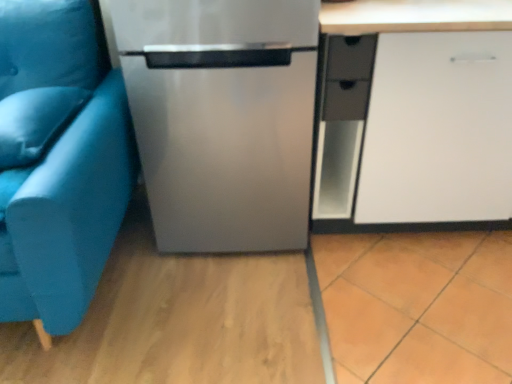
Describe the element at coordinates (414, 115) in the screenshot. I see `white matte cabinet at right` at that location.

Locate an element on the screen. The image size is (512, 384). satin blue pillow at left is located at coordinates (36, 122).

Where is `white matte cabinet at right`? white matte cabinet at right is located at coordinates (414, 115).

Considering the sizes of satin blue pillow at left and teal fabric studio couch at left in the image, is satin blue pillow at left bigger or smaller than teal fabric studio couch at left?

satin blue pillow at left is smaller than teal fabric studio couch at left.

Is teal fabric studio couch at left located within satin blue pillow at left?

No, teal fabric studio couch at left is not inside satin blue pillow at left.

This screenshot has height=384, width=512. I want to click on pillow above the teal fabric studio couch at left (from the image's perspective), so (36, 122).

In terms of height, does satin blue pillow at left look taller or shorter compared to teal fabric studio couch at left?

satin blue pillow at left is shorter than teal fabric studio couch at left.

Measure the distance from teal fabric studio couch at left to satin blue pillow at left.

A distance of 4.81 inches exists between teal fabric studio couch at left and satin blue pillow at left.

Is teal fabric studio couch at left facing away from satin blue pillow at left?

Yes, satin blue pillow at left is at the back of teal fabric studio couch at left.

In the scene shown: Are teal fabric studio couch at left and satin blue pillow at left far apart?

That's not correct — teal fabric studio couch at left is a little close to satin blue pillow at left.

Does teal fabric studio couch at left have a lesser width compared to satin blue pillow at left?

No, teal fabric studio couch at left is not thinner than satin blue pillow at left.

What's the angular difference between stainless steel refrigerator at center and matte black drawer at center right's facing directions?

stainless steel refrigerator at center and matte black drawer at center right are facing 1.15 degrees away from each other.

Between stainless steel refrigerator at center and matte black drawer at center right, which one has larger width?

With larger width is stainless steel refrigerator at center.

Who is bigger, stainless steel refrigerator at center or matte black drawer at center right?

stainless steel refrigerator at center.

Where is `pillow in front of the stainless steel refrigerator at center`? pillow in front of the stainless steel refrigerator at center is located at coordinates (36, 122).

Is stainless steel refrigerator at center looking in the opposite direction of satin blue pillow at left?

stainless steel refrigerator at center is not turned away from satin blue pillow at left.

Is point (150, 17) positioned in front of point (8, 126)?

No, it is behind (8, 126).

Considering their positions, is white matte cabinet at right located in front of or behind teal fabric studio couch at left?

Visually, white matte cabinet at right is located behind teal fabric studio couch at left.

From the image's perspective, is white matte cabinet at right on top of teal fabric studio couch at left?

Yes, from the image's perspective, white matte cabinet at right is above teal fabric studio couch at left.

From a real-world perspective, between white matte cabinet at right and teal fabric studio couch at left, who is vertically lower?

white matte cabinet at right is physically lower.

Which point is more forward, [426,196] or [61,135]?

The point [61,135] is closer.

Looking at their sizes, would you say white matte cabinet at right is wider or thinner than matte black drawer at center right?

Considering their sizes, white matte cabinet at right looks broader than matte black drawer at center right.

From the image's perspective, between white matte cabinet at right and matte black drawer at center right, who is located below?

From the image's view, white matte cabinet at right is below.

Can you confirm if white matte cabinet at right is bigger than matte black drawer at center right?

Yes.

In terms of height, does teal fabric studio couch at left look taller or shorter compared to stainless steel refrigerator at center?

In the image, teal fabric studio couch at left appears to be taller than stainless steel refrigerator at center.

From the image's perspective, is teal fabric studio couch at left located beneath stainless steel refrigerator at center?

Yes, from the image's perspective, teal fabric studio couch at left is beneath stainless steel refrigerator at center.

Who is bigger, teal fabric studio couch at left or stainless steel refrigerator at center?

teal fabric studio couch at left is bigger.

Between teal fabric studio couch at left and stainless steel refrigerator at center, which one appears on the left side from the viewer's perspective?

teal fabric studio couch at left is more to the left.

Where is `pillow above the teal fabric studio couch at left (from the image's perspective)`? pillow above the teal fabric studio couch at left (from the image's perspective) is located at coordinates (36, 122).

This screenshot has width=512, height=384. I want to click on pillow behind the teal fabric studio couch at left, so [36, 122].

Which object lies nearer to the anchor point teal fabric studio couch at left, satin blue pillow at left or stainless steel refrigerator at center?

satin blue pillow at left is closer to teal fabric studio couch at left.

From the image, which object appears to be farther from white matte cabinet at right, teal fabric studio couch at left or satin blue pillow at left?

Among the two, satin blue pillow at left is located further to white matte cabinet at right.

Based on the photo, from the image, which object appears to be nearer to matte black drawer at center right, white matte cabinet at right or teal fabric studio couch at left?

white matte cabinet at right.

When comparing their distances from teal fabric studio couch at left, does matte black drawer at center right or stainless steel refrigerator at center seem closer?

stainless steel refrigerator at center is positioned closer to the anchor teal fabric studio couch at left.

Looking at the image, which one is located further to stainless steel refrigerator at center, teal fabric studio couch at left or white matte cabinet at right?

white matte cabinet at right.

Based on their spatial positions, is white matte cabinet at right or satin blue pillow at left closer to matte black drawer at center right?

The object closer to matte black drawer at center right is white matte cabinet at right.

From the image, which object appears to be farther from white matte cabinet at right, matte black drawer at center right or satin blue pillow at left?

Among the two, satin blue pillow at left is located further to white matte cabinet at right.

Which object lies further to the anchor point satin blue pillow at left, teal fabric studio couch at left or matte black drawer at center right?

matte black drawer at center right.

At what (x,y) coordinates should I click in order to perform the action: click on drawer between stainless steel refrigerator at center and white matte cabinet at right in the horizontal direction. Please return your answer as a coordinate pair (x, y). The width and height of the screenshot is (512, 384). Looking at the image, I should click on point(348,77).

Locate an element on the screen. The width and height of the screenshot is (512, 384). drawer between satin blue pillow at left and white matte cabinet at right in the horizontal direction is located at coordinates (348, 77).

Image resolution: width=512 pixels, height=384 pixels. In order to click on pillow between teal fabric studio couch at left and matte black drawer at center right in the horizontal direction in this screenshot , I will do `click(36, 122)`.

This screenshot has height=384, width=512. In order to click on pillow between teal fabric studio couch at left and stainless steel refrigerator at center in the horizontal direction in this screenshot , I will do `click(36, 122)`.